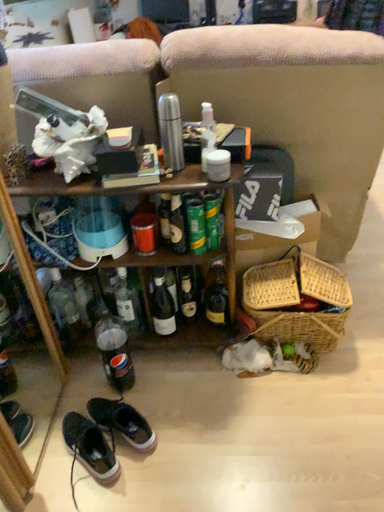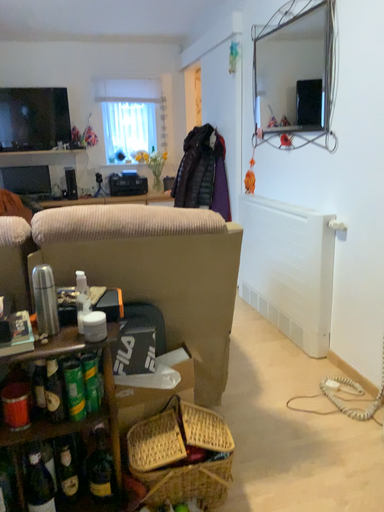
Question: How did the camera likely rotate when shooting the video?

Choices:
 (A) rotated left
 (B) rotated right

Answer: (B)